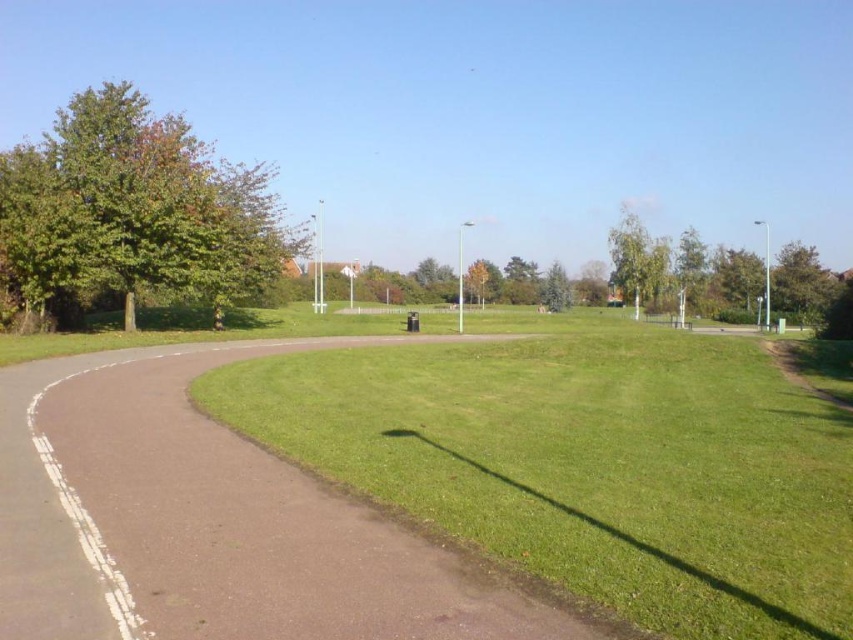
Question: Is green grassy at center in front of green leafy tree at upper center?

Choices:
 (A) yes
 (B) no

Answer: (A)

Question: Which point appears farthest from the camera in this image?

Choices:
 (A) (795, 307)
 (B) (643, 278)
 (C) (715, 573)

Answer: (A)

Question: Which object is positioned closest to the green grassy at center?

Choices:
 (A) green leafy tree at upper right
 (B) green leafy tree at upper center
 (C) green leafy tree at left
 (D) brown asphalt path at center

Answer: (D)

Question: Is brown asphalt path at center closer to the viewer compared to green leafy tree at left?

Choices:
 (A) no
 (B) yes

Answer: (B)

Question: Does green leafy tree at left appear on the left side of green leafy tree at upper right?

Choices:
 (A) yes
 (B) no

Answer: (A)

Question: Which point is farther from the camera taking this photo?

Choices:
 (A) (163, 529)
 (B) (93, 196)
 (C) (811, 259)

Answer: (C)